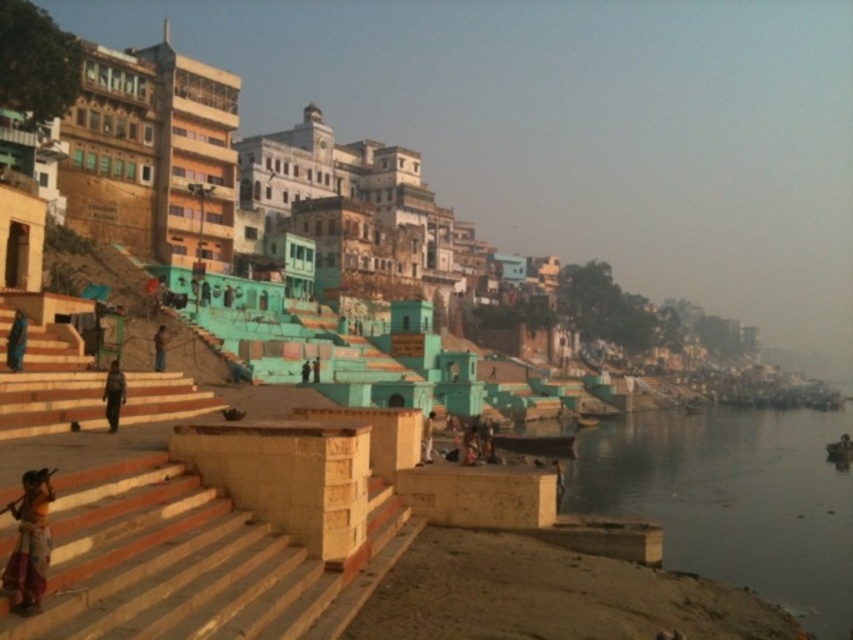
Question: Estimate the real-world distances between objects in this image. Which object is closer to the dark blue fabric at lower left?

Choices:
 (A) dark blue fabric person at center
 (B) brown fabric person at lower left

Answer: (B)

Question: Which of the following is the farthest from the observer?

Choices:
 (A) beige stone stairs at lower left
 (B) dark blue fabric person at center
 (C) brown fabric person at lower left

Answer: (B)

Question: Where is beige stone stairs at lower left located in relation to brown leather bag at lower left in the image?

Choices:
 (A) above
 (B) below

Answer: (B)

Question: Which object appears closest to the camera in this image?

Choices:
 (A) beige stone stairs at lower left
 (B) dark blue fabric person at center
 (C) brown leather bag at lower left
 (D) orange cotton sari at lower left

Answer: (A)

Question: Is beige stone stairs at lower left thinner than brown fabric person at lower left?

Choices:
 (A) yes
 (B) no

Answer: (B)

Question: Can you confirm if orange cotton sari at lower left is smaller than brown leather bag at lower left?

Choices:
 (A) yes
 (B) no

Answer: (A)